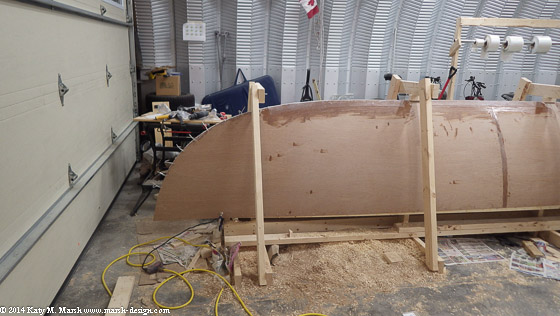
Locate an element on the screen. Image resolution: width=560 pixels, height=316 pixels. paper rolls is located at coordinates (543, 40), (505, 44), (494, 40), (483, 40).